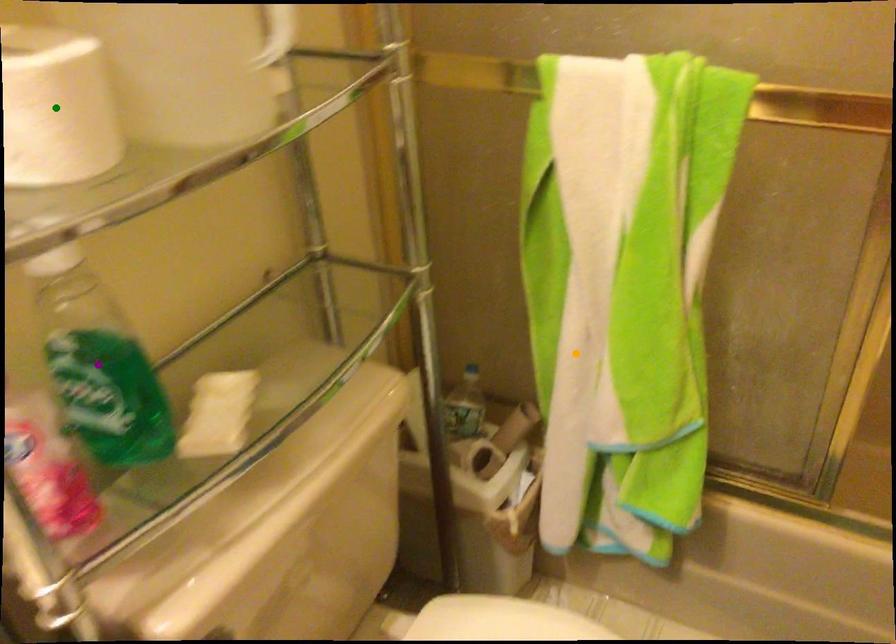
Order these from nearest to farthest:
- orange point
- purple point
- green point

green point < purple point < orange point